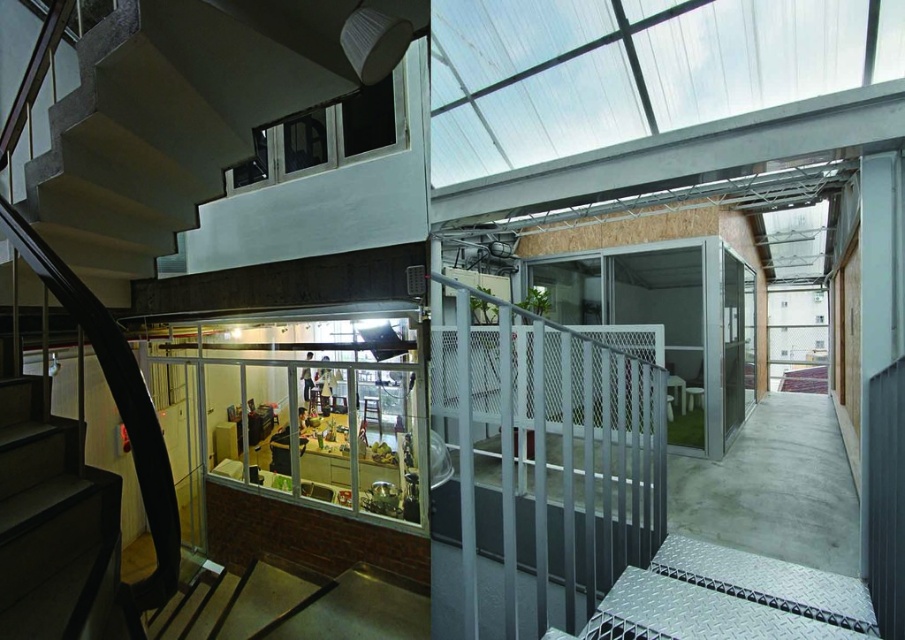
In the scene shown: You are a delivery person carrying a large package that is 1.2 meters wide. You need to move from the lower kitchen area to the upper level. The path requires passing through the metallic mesh railing at center and the concrete stairs at lower left. Can you fit through both areas without needing to adjust the package?

The metallic mesh railing at center might be wider than concrete stairs at lower left, but since the package is 1.2 meters wide, it is uncertain if either can accommodate it without knowing their exact widths. You may need to check the actual dimensions before proceeding.

You are standing at the top of the staircase and want to reach the dining area on the lower level. The metallic mesh railing at center is in your way. Can you step over it?

The metallic mesh railing at center is 4.49 feet from camera, so stepping over it would be difficult as it is taller than average stepping height.

From the picture: You are standing at the top of the staircase and want to move towards the kitchen area. There are two points marked in the image, point [437,621] and point [59,454]. Which point should you move towards to get closer to the kitchen?

You should move towards point [59,454] because it is closer to the kitchen area. Since point [437,621] is further away from the viewer compared to point [59,454], moving towards the latter would bring you nearer to the kitchen located in the lower level.